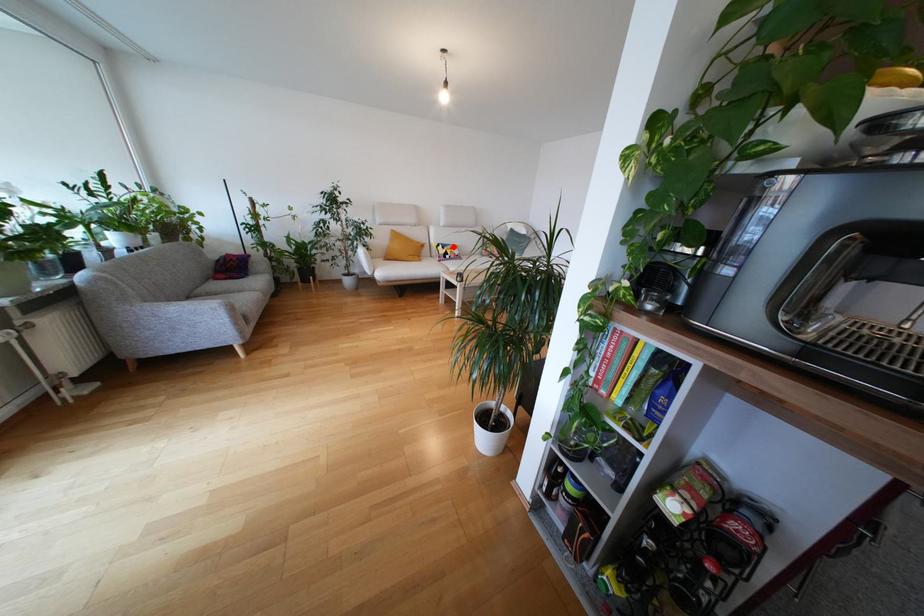
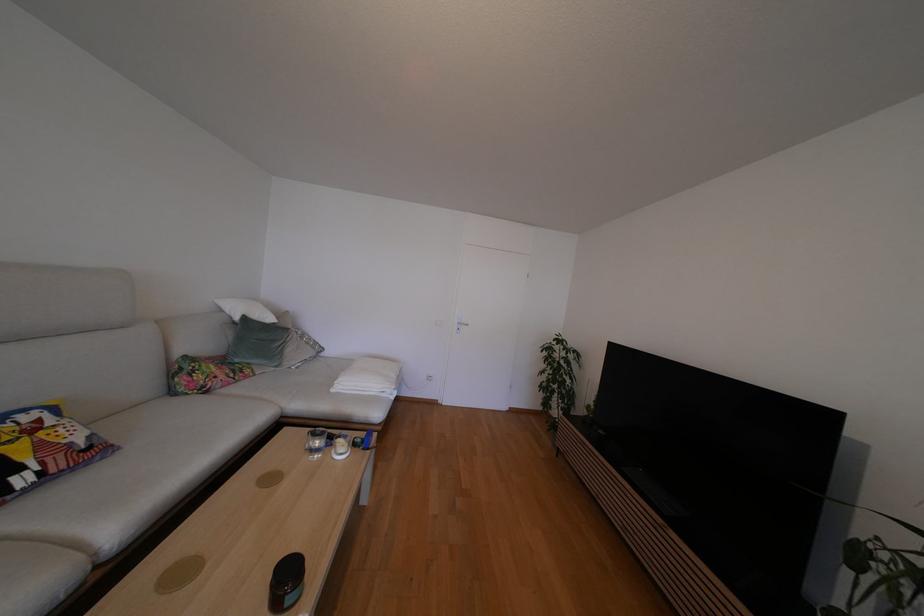
Question: A red point is marked in image1. In image2, is the corresponding 3D point closer to the camera or farther? Reply with the corresponding letter.

Choices:
 (A) The corresponding 3D point is closer.
 (B) The corresponding 3D point is farther.

Answer: (B)